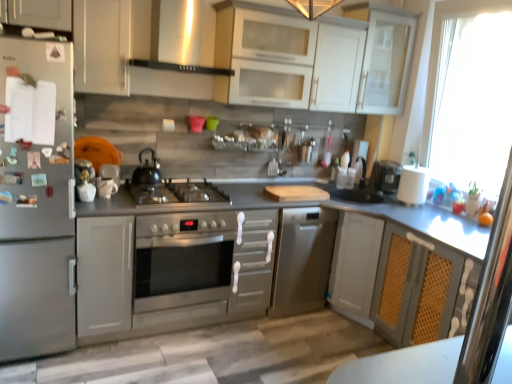
I want to click on vacant space in front of white glossy coffee cup at center, so click(103, 207).